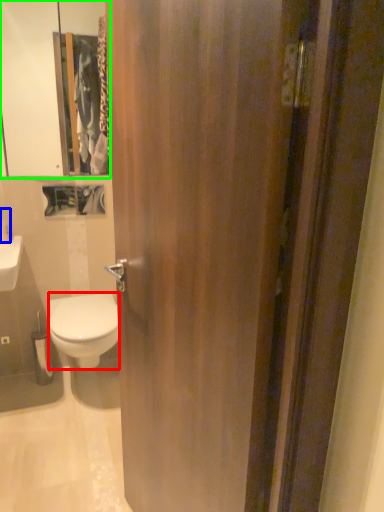
Question: Which object is positioned farthest from bidet (highlighted by a red box)? Select from toiletry (highlighted by a blue box) and medicine cabinet (highlighted by a green box).

Choices:
 (A) toiletry
 (B) medicine cabinet

Answer: (B)